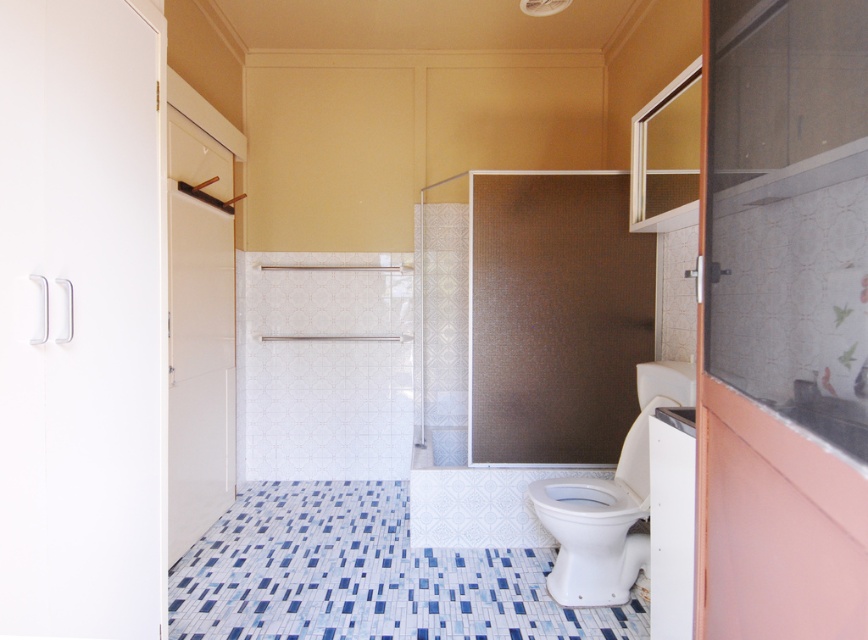
Question: Does white glossy toilet at lower right appear over white glossy sink at upper right?

Choices:
 (A) yes
 (B) no

Answer: (B)

Question: In this image, where is blue mosaic tile at lower center located relative to white glossy toilet at lower right?

Choices:
 (A) above
 (B) below

Answer: (B)

Question: Which object is farther from the camera taking this photo?

Choices:
 (A) white glossy sink at upper right
 (B) white glossy toilet bowl at lower right
 (C) blue mosaic tile at lower center

Answer: (B)

Question: Is the position of white matte cabinet at left more distant than that of white glossy toilet bowl at lower right?

Choices:
 (A) yes
 (B) no

Answer: (B)

Question: Which of these objects is positioned closest to the white matte cabinet at left?

Choices:
 (A) white glossy toilet bowl at lower right
 (B) blue mosaic tile at lower center
 (C) white glossy toilet at lower right

Answer: (B)

Question: Based on their relative distances, which object is nearer to the white glossy toilet at lower right?

Choices:
 (A) white glossy toilet bowl at lower right
 (B) white matte cabinet at left

Answer: (A)